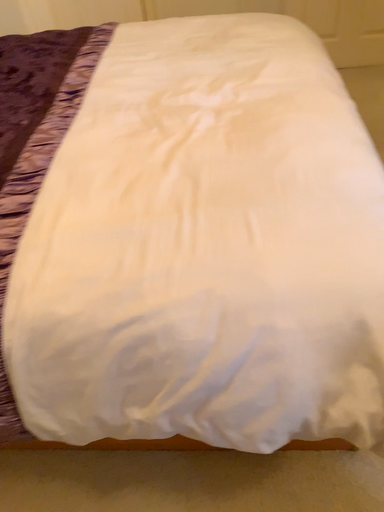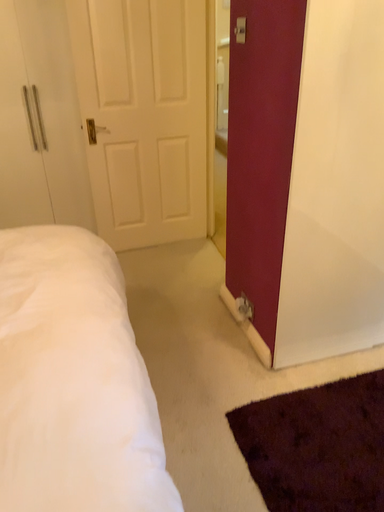
Question: Which way did the camera rotate in the video?

Choices:
 (A) rotated upward
 (B) rotated downward

Answer: (A)